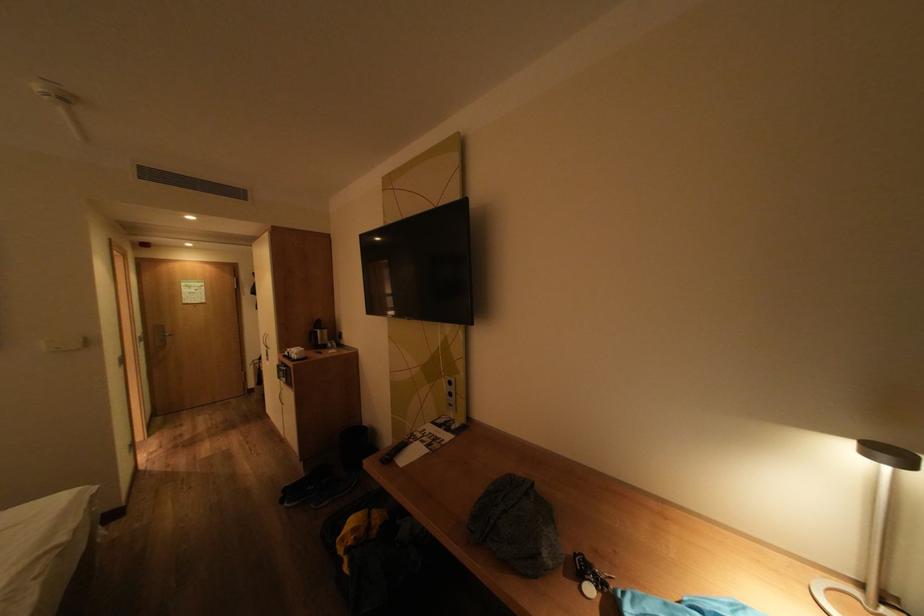
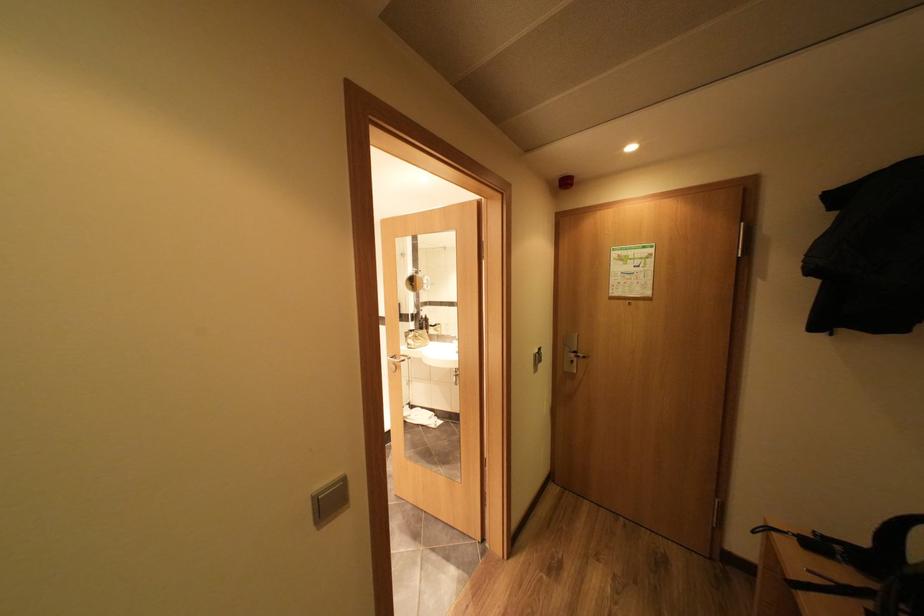
In the second image, find the point that corresponds to point 198,306 in the first image.

(626, 302)